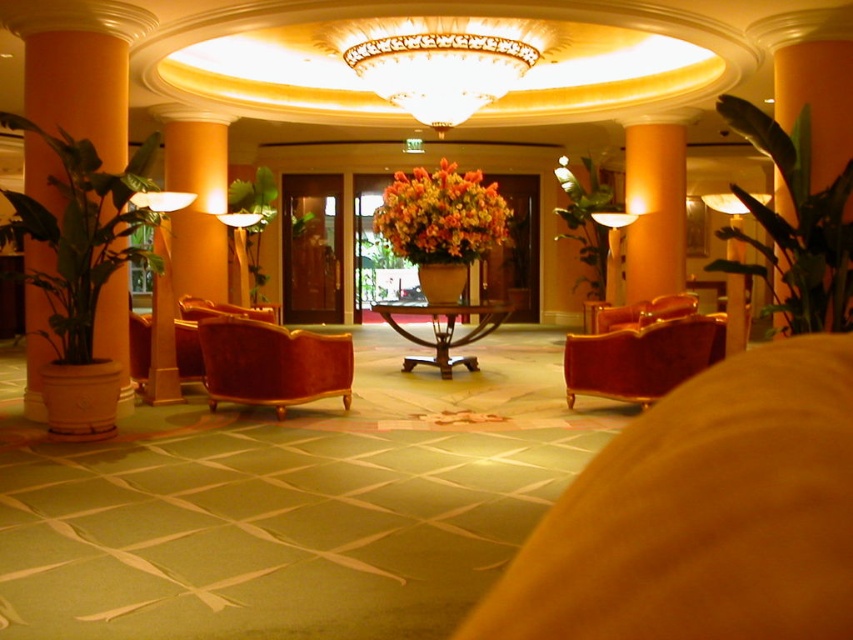
You are a guest in this hotel lobby and want to place your 1.20 meter long luggage between the matte gold lamp at upper center and the velvet red armchair at center. Is there enough space to fit your luggage there?

The distance between the matte gold lamp at upper center and the velvet red armchair at center is 1.30 meters, which is slightly longer than your 1.20 meter luggage. Therefore, there is enough space to fit your luggage between them.

You are standing at point (676, 147) and want to move to the other side of the room. The room is 36.35 feet wide. Can you walk straight without crossing the room?

The distance between you and the other side of the room is 36.35 feet, which is the same as the room width. Therefore, walking straight would take you to the other side without crossing the room.